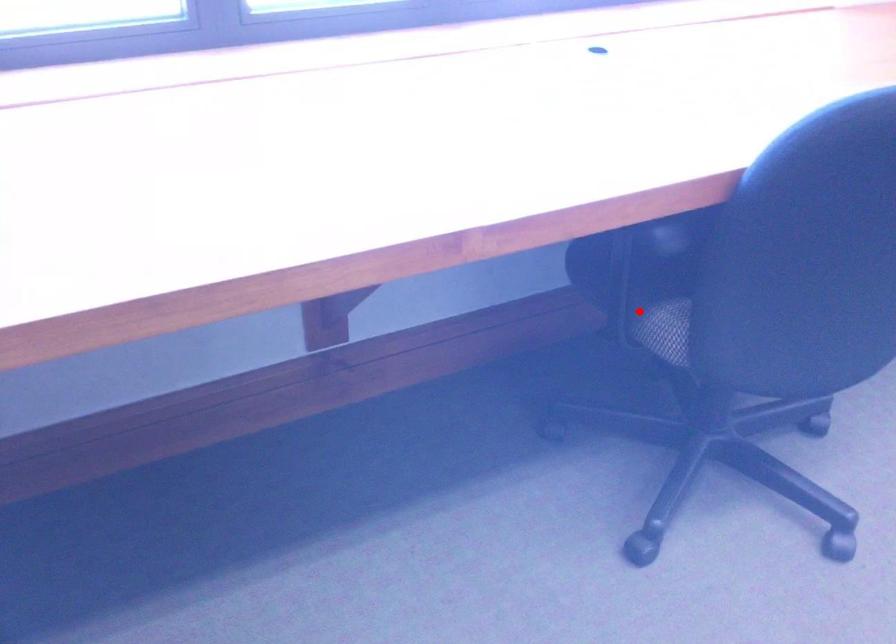
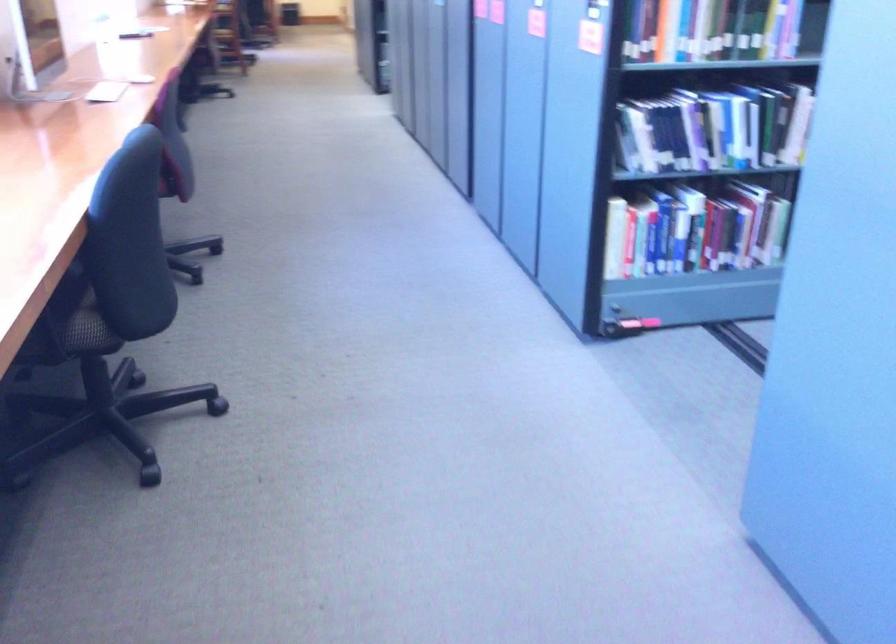
Where in the second image is the point corresponding to the highlighted location from the first image?

(73, 324)